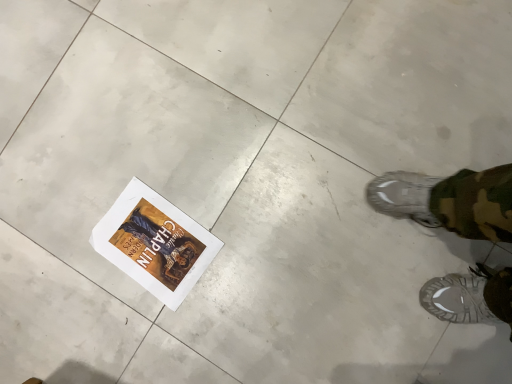
Locate an element on the screen. This screenshot has height=384, width=512. free space underneath white paper postcard at lower left (from a real-world perspective) is located at coordinates (146, 233).